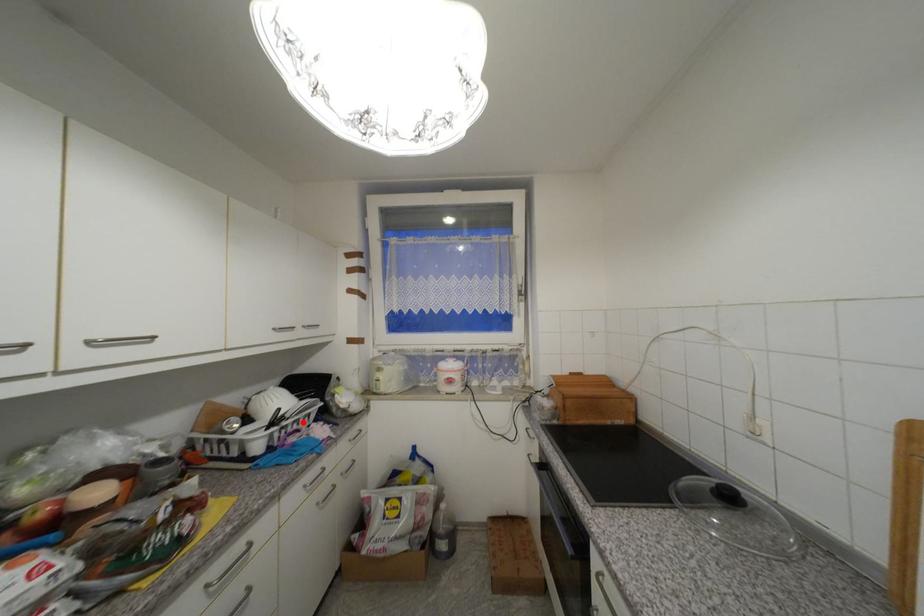
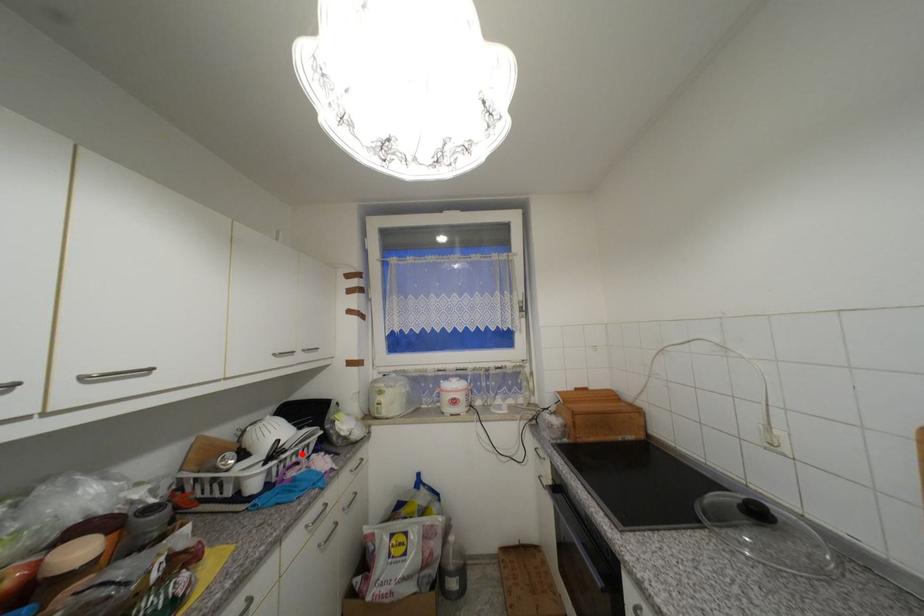
I am providing you with two images of the same scene from different viewpoints. A red point is marked on the first image and another point is marked on the second image. Are the points marked in image1 and image2 representing the same 3D position?

Yes